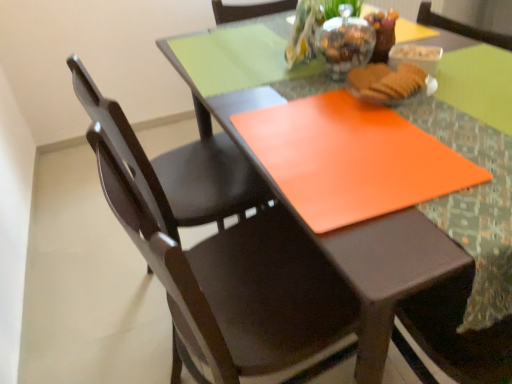
Question: Considering the relative sizes of matte brown biscuit at center and transparent glass jar at upper center in the image provided, is matte brown biscuit at center taller than transparent glass jar at upper center?

Choices:
 (A) yes
 (B) no

Answer: (B)

Question: Is matte brown biscuit at center touching transparent glass jar at upper center?

Choices:
 (A) yes
 (B) no

Answer: (A)

Question: Is matte brown biscuit at center positioned behind transparent glass jar at upper center?

Choices:
 (A) no
 (B) yes

Answer: (A)

Question: Can you confirm if matte brown biscuit at center is shorter than transparent glass jar at upper center?

Choices:
 (A) yes
 (B) no

Answer: (A)

Question: Is matte brown biscuit at center at the right side of transparent glass jar at upper center?

Choices:
 (A) yes
 (B) no

Answer: (A)

Question: From the image's perspective, is matte brown biscuit at center beneath transparent glass jar at upper center?

Choices:
 (A) no
 (B) yes

Answer: (B)

Question: From the image's perspective, is orange matte placemat at center above matte dark wood chair at center, placed as the 2th chair when sorted from back to front?

Choices:
 (A) yes
 (B) no

Answer: (A)

Question: Is orange matte placemat at center at the right side of matte dark wood chair at center, placed as the 2th chair when sorted from back to front?

Choices:
 (A) yes
 (B) no

Answer: (A)

Question: Is orange matte placemat at center not near matte dark wood chair at center, placed as the 2th chair when sorted from back to front?

Choices:
 (A) yes
 (B) no

Answer: (B)

Question: Is the position of orange matte placemat at center less distant than that of matte dark wood chair at center, placed as the 2th chair when sorted from back to front?

Choices:
 (A) yes
 (B) no

Answer: (B)

Question: Is orange matte placemat at center oriented towards matte dark wood chair at center, placed as the 2th chair when sorted from back to front?

Choices:
 (A) yes
 (B) no

Answer: (A)

Question: Does orange matte placemat at center touch matte dark wood chair at center, placed as the 2th chair when sorted from back to front?

Choices:
 (A) yes
 (B) no

Answer: (B)

Question: Is orange matte placemat at center outside of orange matte placemat at center?

Choices:
 (A) no
 (B) yes

Answer: (A)